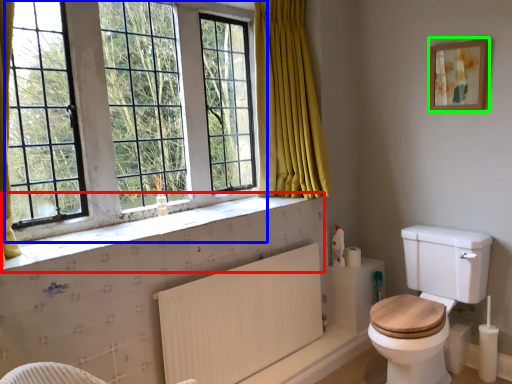
Question: Considering the real-world distances, which object is farthest from window sill (highlighted by a red box)? window (highlighted by a blue box) or picture frame (highlighted by a green box)?

Choices:
 (A) window
 (B) picture frame

Answer: (B)